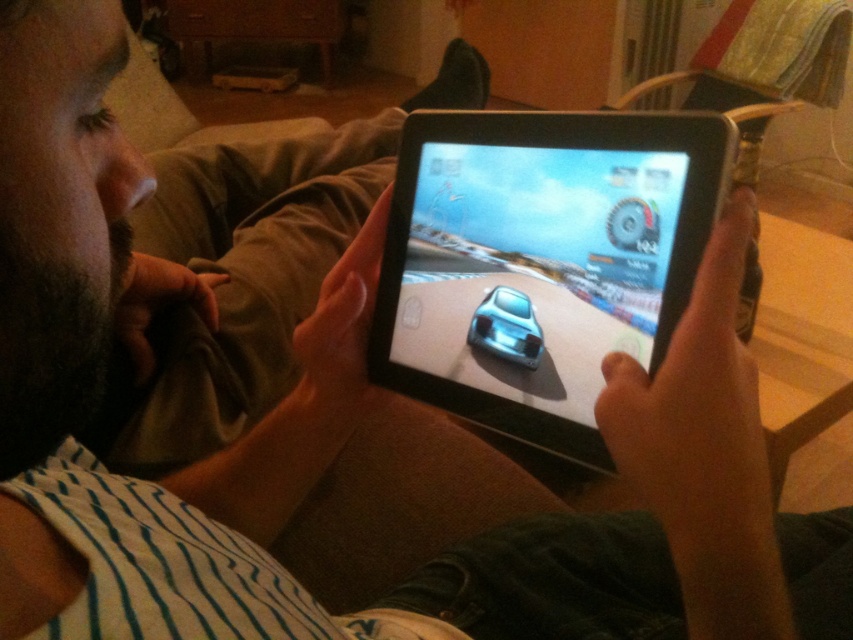
Consider the image. You are a game developer analyzing the screen layout of the black glossy tablet at center. You need to ensure that the satin silver car at center can fit entirely within the tablet screen without being cut off. Can you confirm if the car will fit based on their sizes?

The black glossy tablet at center might be wider than satin silver car at center, so there is a possibility that the car will fit within the tablet screen. However, since the exact dimensions are not provided, further measurements are needed to confirm.

You are designing a stand for the black glossy tablet at center and the satin silver car at center. The stand needs to hold both items vertically. Which item should be placed at the bottom of the stand to ensure stability?

The black glossy tablet at center is taller than the satin silver car at center, so placing the taller black glossy tablet at center at the bottom of the stand would provide better stability due to its lower center of gravity.

In the scene shown: You are a game developer analyzing the placement of the speedometer on the tablet screen. The tablet is at the center of the image. You need to place a new icon exactly at the point with coordinates (541,259). According to the image, will this new icon overlap with the black glossy tablet at center?

The point (541,259) is on the black glossy tablet at center, so placing the new icon there will overlap with the black glossy tablet at center.